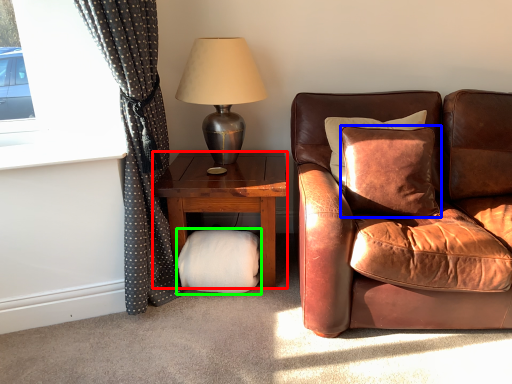
Question: Considering the real-world distances, which object is closest to studio couch (highlighted by a red box)? pillow (highlighted by a blue box) or footrest (highlighted by a green box).

Choices:
 (A) pillow
 (B) footrest

Answer: (B)